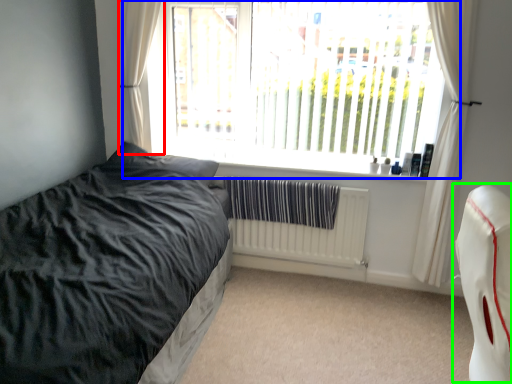
Question: Which object is positioned farthest from curtain (highlighted by a red box)? Select from window (highlighted by a blue box) and swivel chair (highlighted by a green box).

Choices:
 (A) window
 (B) swivel chair

Answer: (B)